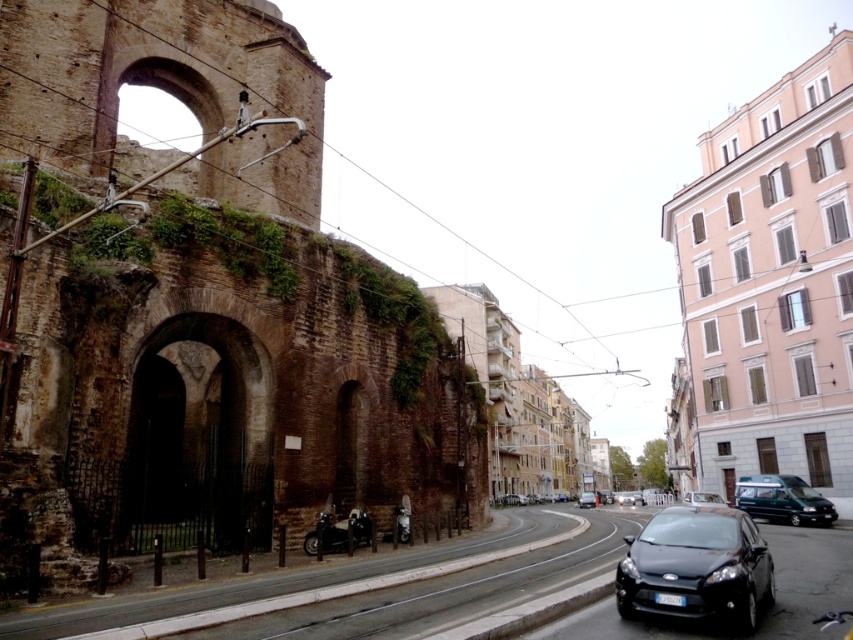
Does shiny black car at lower right have a lesser height compared to shiny black sedan at center?

Indeed, shiny black car at lower right has a lesser height compared to shiny black sedan at center.

This screenshot has height=640, width=853. Find the location of `shiny black car at lower right`. shiny black car at lower right is located at coordinates (695, 566).

Between point (749, 532) and point (587, 497), which one is positioned behind?

The point (587, 497) is behind.

The image size is (853, 640). Identify the location of shiny black car at lower right. (695, 566).

Does dark brown stone archway at left come in front of shiny black sedan at center?

That is True.

Which is below, dark brown stone archway at left or shiny black sedan at center?

shiny black sedan at center

Find the location of `dark brown stone archway at left`. dark brown stone archway at left is located at coordinates (199, 436).

Does dark brown stone archway at left appear under shiny black motorcycle at lower center?

Actually, dark brown stone archway at left is above shiny black motorcycle at lower center.

Is dark brown stone archway at left smaller than shiny black motorcycle at lower center?

Incorrect, dark brown stone archway at left is not smaller in size than shiny black motorcycle at lower center.

What do you see at coordinates (199, 436) in the screenshot? This screenshot has height=640, width=853. I see `dark brown stone archway at left` at bounding box center [199, 436].

Locate an element on the screen. Image resolution: width=853 pixels, height=640 pixels. dark brown stone archway at left is located at coordinates (199, 436).